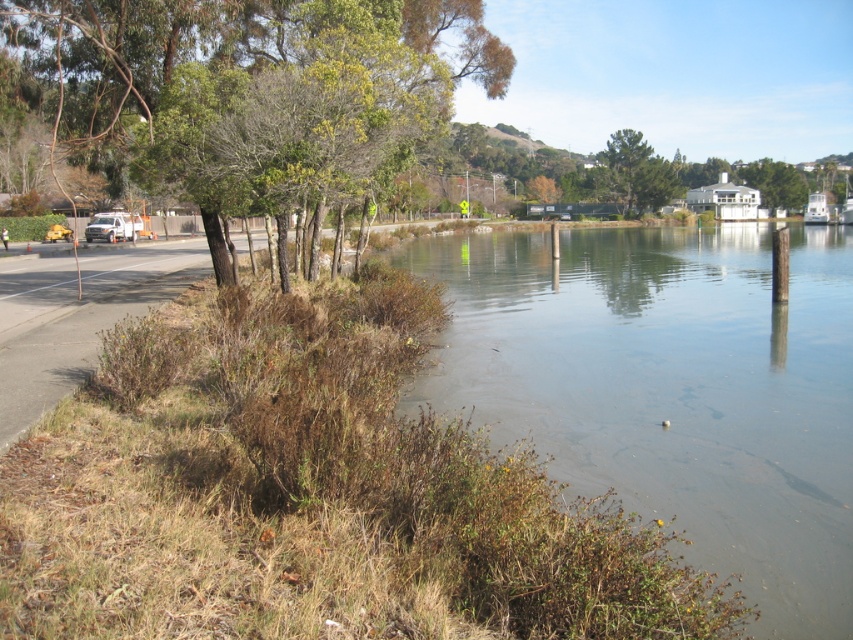
You are a pedestrian standing on the paved road near the white matte van at left. You want to cross to the brown grassy river at lower left. Is the river directly in front of you or behind the van?

The brown grassy river at lower left is positioned under the white matte van at left, so it is behind the van. Therefore, the river is not directly in front of you but behind the van.

You are a hiker standing on the riverbank and want to take a photo of both the green leafy tree at upper left and the green matte tree at upper center. Which tree should you position yourself closer to in order to capture both in the same frame?

To capture both the green leafy tree at upper left and the green matte tree at upper center in the same frame, you should position yourself closer to the green leafy tree at upper left since it is located to the left of the green matte tree at upper center.

You are a delivery driver who needs to park your vehicle behind the white matte van at left without blocking the road. The green leafy tree at upper left is in the way. Can you park your vehicle there?

The green leafy tree at upper left is taller than the white matte van at left. Since the tree is blocking the area behind the van, you cannot park there without obstructing the road.